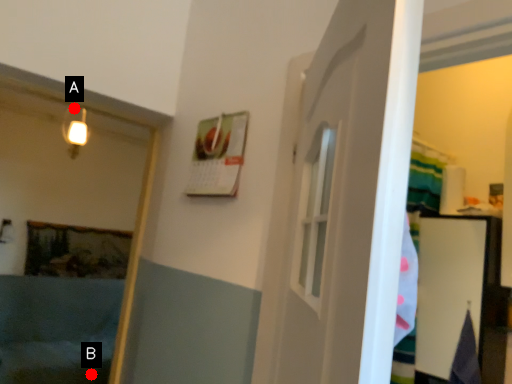
Question: Two points are circled on the image, labeled by A and B beside each circle. Which point is closer to the camera taking this photo?

Choices:
 (A) A is closer
 (B) B is closer

Answer: (A)